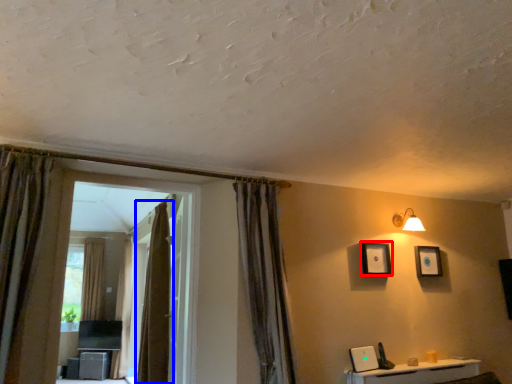
Question: Which point is further to the camera, picture frame (highlighted by a red box) or curtain (highlighted by a blue box)?

Choices:
 (A) picture frame
 (B) curtain

Answer: (B)